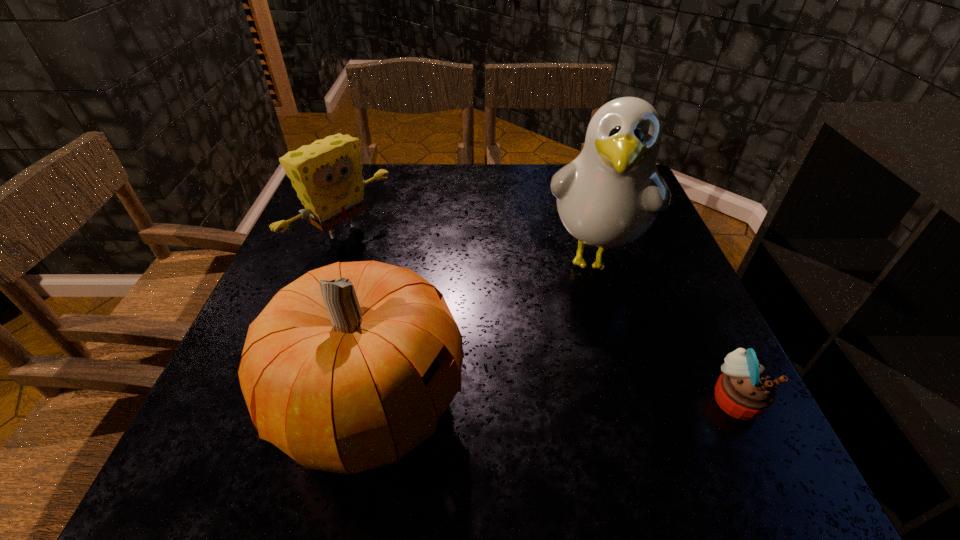
Image resolution: width=960 pixels, height=540 pixels. What are the coordinates of `object present at the far left corner` in the screenshot? It's located at (327, 175).

Find the location of `object that is at the near left corner`. object that is at the near left corner is located at coordinates (348, 368).

The height and width of the screenshot is (540, 960). I want to click on object located in the near right corner section of the desktop, so click(x=743, y=391).

Where is `vacant space at the far edge of the desktop`? vacant space at the far edge of the desktop is located at coordinates (462, 187).

You are a GUI agent. You are given a task and a screenshot of the screen. Output one action in this format:
    pyautogui.click(x=<x>, y=<y>)
    Task: Click on the free space at the right edge of the desktop
    The image size is (960, 540).
    Given the screenshot: What is the action you would take?
    pyautogui.click(x=633, y=342)

Locate an element on the screen. This screenshot has width=960, height=540. vacant space at the near right corner of the desktop is located at coordinates (648, 384).

Where is `empty location between the third shortest object and the tallest object`? This screenshot has width=960, height=540. empty location between the third shortest object and the tallest object is located at coordinates (482, 332).

The height and width of the screenshot is (540, 960). I want to click on free area in between the shortest object and the pumpkin, so click(x=553, y=402).

Locate an element on the screen. The height and width of the screenshot is (540, 960). empty space between the third object from left to right and the pumpkin is located at coordinates (482, 332).

Locate an element on the screen. unoccupied position between the rightmost object and the third tallest object is located at coordinates (540, 318).